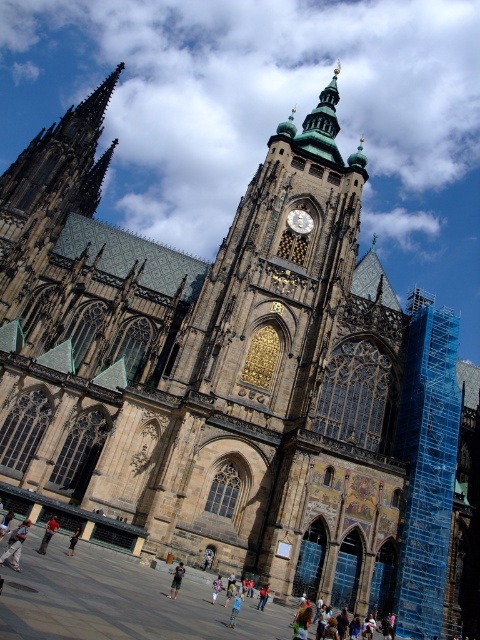
You are an architect analyzing the cathedral facade. You notice the gold textured clock at center and the dark gray fabric pants at lower center. Which object takes up more area on the facade?

The dark gray fabric pants at lower center occupies more space than the gold textured clock at center according to the description.

You are a tourist standing in front of the cathedral and notice two people wearing red fabric pants at center and floral fabric dress at center. Which clothing item is closer to you?

The red fabric pants at center is closer to you because it is in front of the floral fabric dress at center.

You are standing in front of the cathedral and want to take a photo of the gold textured clock at center. Where should you position your camera to capture the clock in the frame?

The gold textured clock at center is located at coordinates 0.347 on the x axis and 0.625 on the y axis, so position your camera to aim towards those coordinates to capture it in the frame.